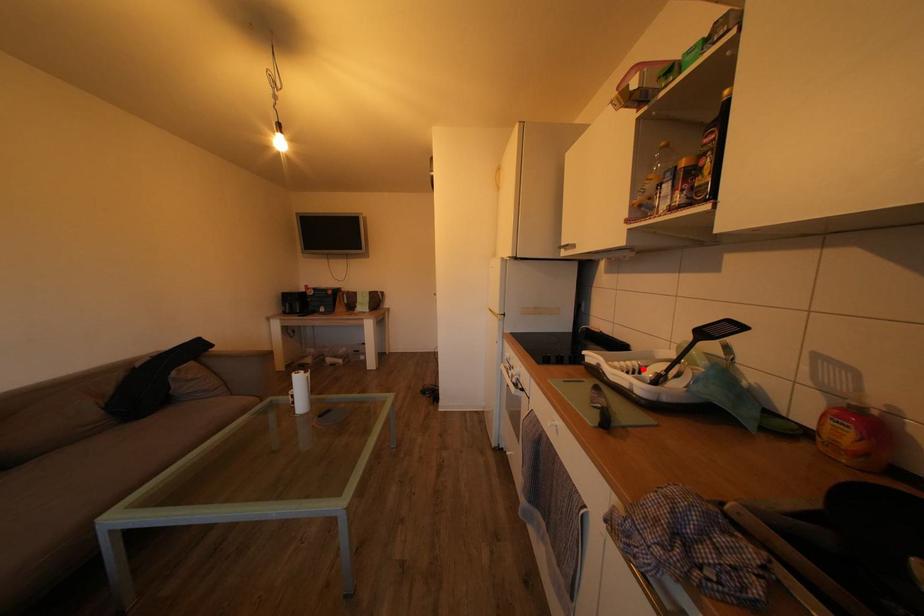
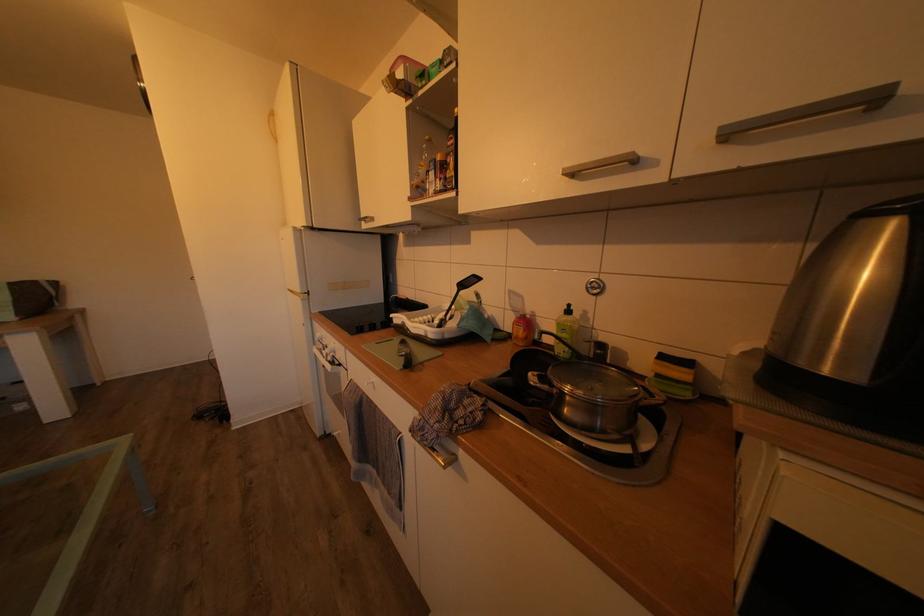
The point at the highlighted location is marked in the first image. Where is the corresponding point in the second image?

(436, 323)